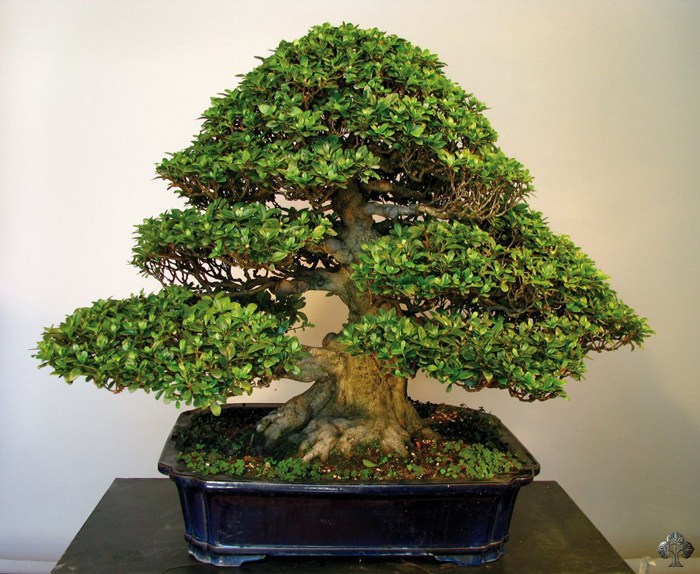
Locate an element on the screen. This screenshot has height=574, width=700. wooden surface is located at coordinates (556, 536), (127, 527).